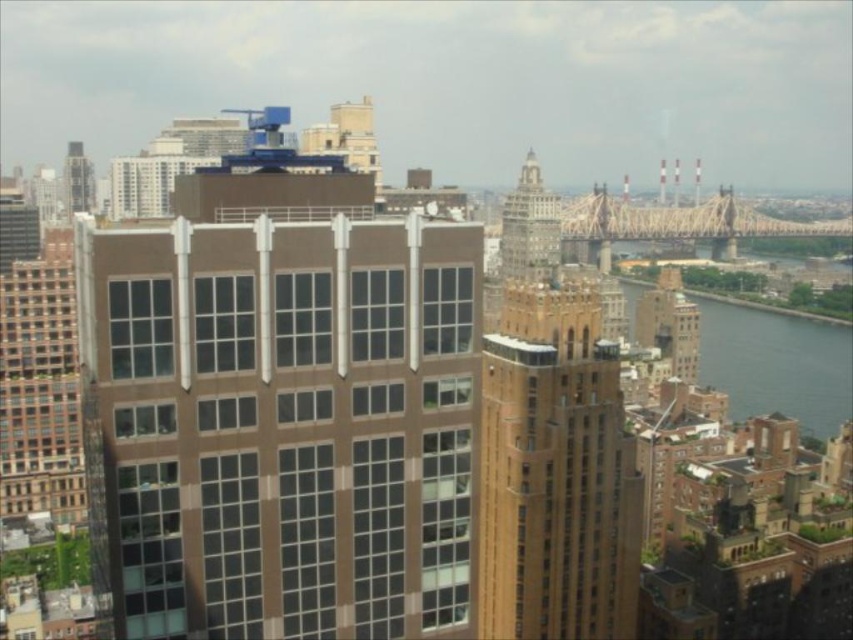
From the picture: You are a city planner assessing the skyline. You need to determine which of the two buildings, the brown brick building at center or the silver metallic tower at upper center, is taller. Based on the provided information, which one is taller?

The brown brick building at center is taller than the silver metallic tower at upper center according to the description.

You are a city planner reviewing the urban layout. Based on the image provided, which of the two buildings, the brown brick building at center or the metallic silver tower at upper left, has a greater height?

The brown brick building at center is taller than the metallic silver tower at upper left according to the description.